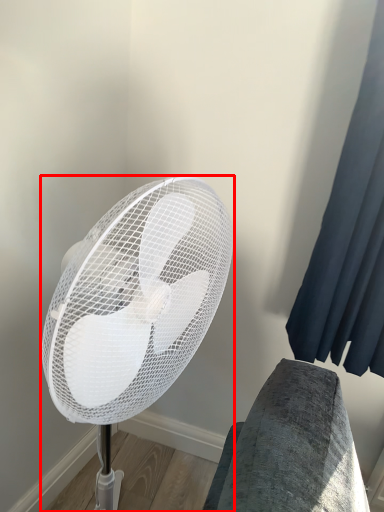
Question: From the image's perspective, where is mechanical fan (annotated by the red box) located relative to curtain?

Choices:
 (A) above
 (B) below

Answer: (B)